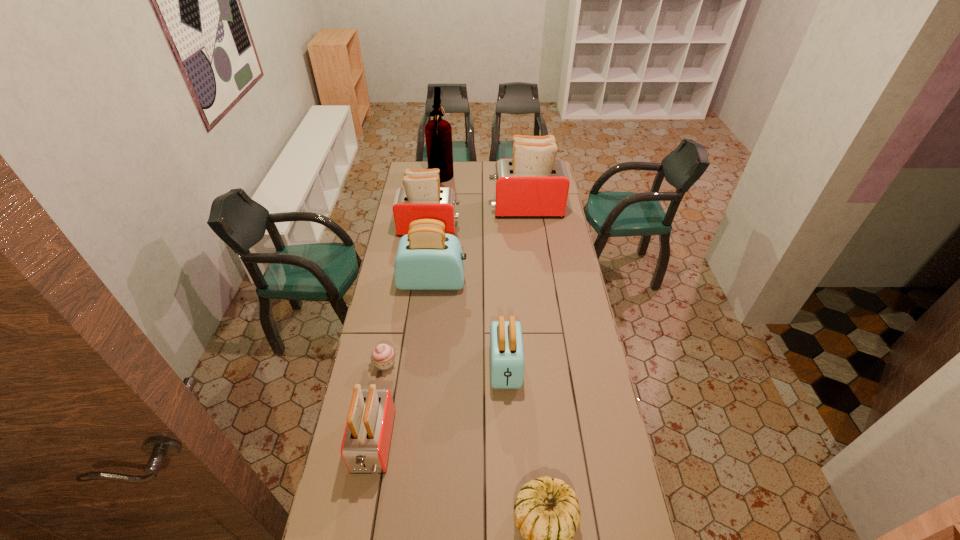
You are a GUI agent. You are given a task and a screenshot of the screen. Output one action in this format:
    pyautogui.click(x=<x>, y=<y>)
    Task: Click on the vacant area between the cupcake and the second nearest toaster
    
    Given the screenshot: What is the action you would take?
    pyautogui.click(x=445, y=365)

Identify the location of free space between the farther light toaster and the shortest object. Image resolution: width=960 pixels, height=540 pixels. (409, 322).

I want to click on free space between the pink cupcake and the second smallest red toaster, so click(x=407, y=296).

Image resolution: width=960 pixels, height=540 pixels. What are the coordinates of `vacant region between the second tallest object and the fire extinguisher` in the screenshot? It's located at (483, 195).

Locate an element on the screen. vacant point located between the second nearest toaster and the seventh farthest object is located at coordinates (440, 405).

This screenshot has height=540, width=960. What are the coordinates of `empty space that is in between the second smallest red toaster and the fourth farthest toaster` in the screenshot? It's located at (468, 298).

Identify which object is the third nearest to the tallest object. Please provide its 2D coordinates. Your answer should be formatted as a tuple, i.e. [(x, y)], where the tuple contains the x and y coordinates of a point satisfying the conditions above.

[(427, 259)]

I want to click on object that is the sixth nearest to the tallest object, so click(x=365, y=447).

Where is `toaster identified as the fourth closest to the seventh shortest object`? The width and height of the screenshot is (960, 540). toaster identified as the fourth closest to the seventh shortest object is located at coordinates (365, 447).

Point out which toaster is positioned as the fifth nearest to the cupcake. Please provide its 2D coordinates. Your answer should be formatted as a tuple, i.e. [(x, y)], where the tuple contains the x and y coordinates of a point satisfying the conditions above.

[(533, 184)]